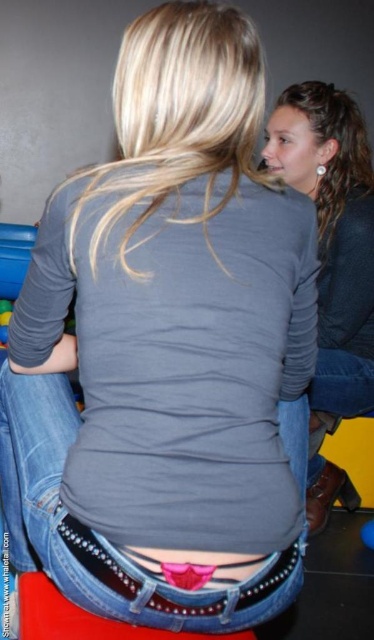
Can you confirm if matte gray shirt at center is thinner than rubberized yellow toy at lower left?

In fact, matte gray shirt at center might be wider than rubberized yellow toy at lower left.

Does matte gray shirt at center have a smaller size compared to rubberized yellow toy at lower left?

Actually, matte gray shirt at center might be larger than rubberized yellow toy at lower left.

The width and height of the screenshot is (374, 640). What do you see at coordinates (332, 262) in the screenshot? I see `matte gray shirt at center` at bounding box center [332, 262].

The height and width of the screenshot is (640, 374). Identify the location of matte gray shirt at center. (332, 262).

Is point (348, 492) more distant than point (50, 612)?

Yes, point (348, 492) is farther from viewer.

Who is more distant from viewer, [313,132] or [63,618]?

The point [313,132] is behind.

Locate an element on the screen. Image resolution: width=374 pixels, height=640 pixels. matte gray shirt at center is located at coordinates (332, 262).

Does jeans at center have a lesser height compared to denim stool at lower center?

No, jeans at center is not shorter than denim stool at lower center.

Based on the photo, does jeans at center appear under denim stool at lower center?

No.

Locate an element on the screen. jeans at center is located at coordinates (102, 536).

This screenshot has height=640, width=374. I want to click on jeans at center, so click(102, 536).